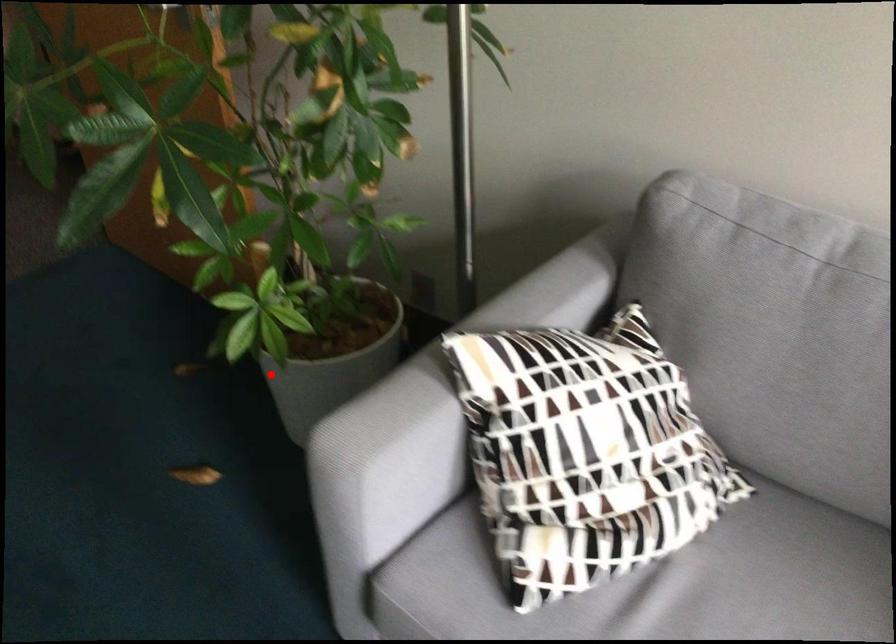
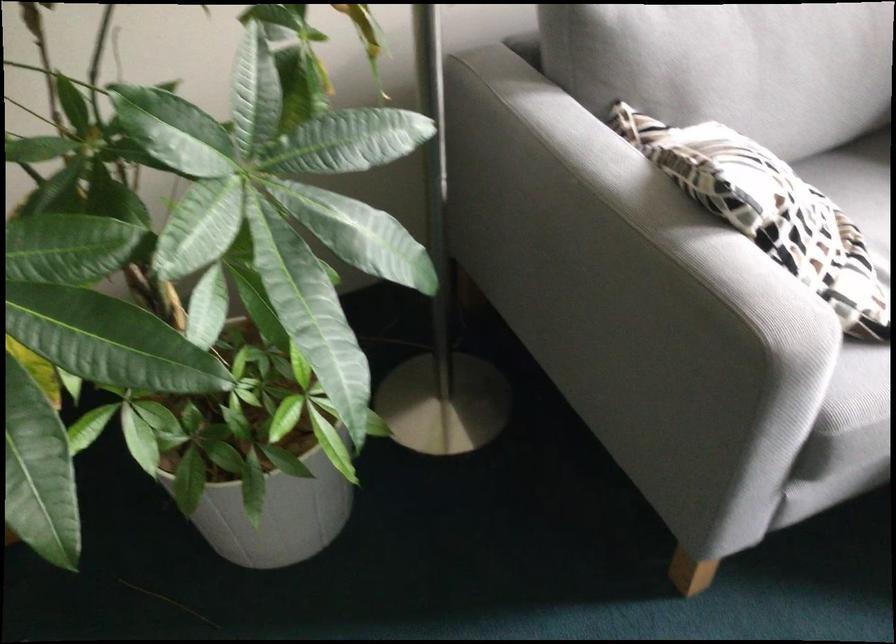
Question: I am providing you with two images of the same scene from different viewpoints. A red point is shown in image1. For the corresponding object point in image2, is it positioned nearer or farther from the camera?

Choices:
 (A) Nearer
 (B) Farther

Answer: (A)